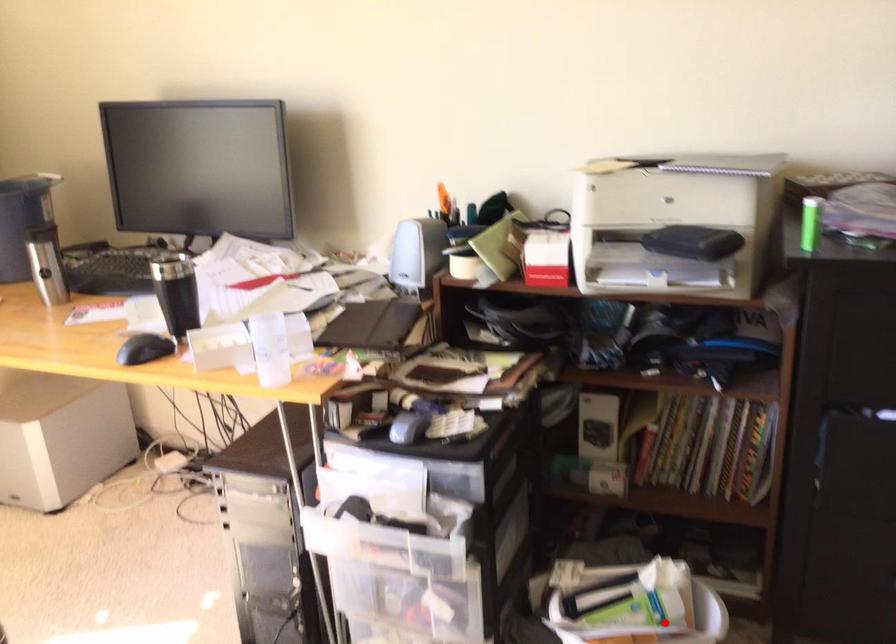
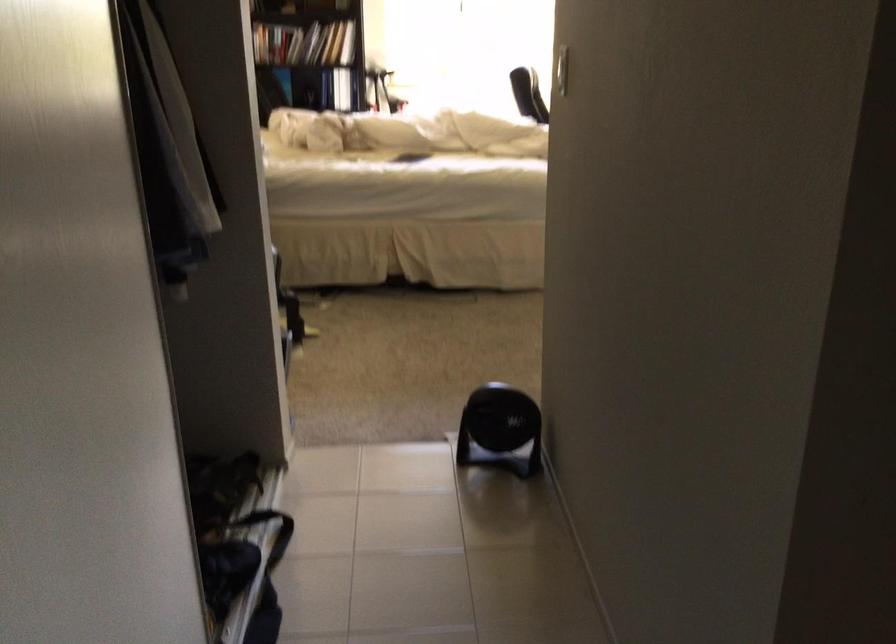
Question: I am providing you with two images of the same scene from different viewpoints. A red point is marked on the first image. At the location where the point appears in image 1, is it still visible in image 2?

Choices:
 (A) Yes
 (B) No

Answer: (B)